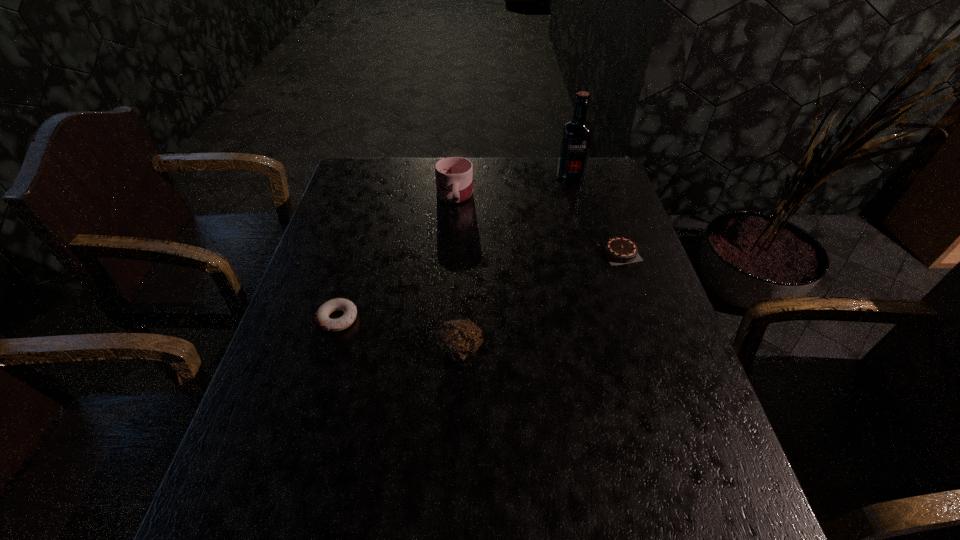
The image size is (960, 540). Identify the location of the tallest object. (576, 137).

The image size is (960, 540). I want to click on the second tallest object, so click(x=454, y=175).

Identify the location of muffin. Image resolution: width=960 pixels, height=540 pixels. (459, 339).

Locate an element on the screen. the third nearest object is located at coordinates (617, 249).

The height and width of the screenshot is (540, 960). In order to click on doughnut in this screenshot , I will do `click(322, 319)`.

I want to click on free space located 0.370m on the front-facing side of the liquor, so click(x=591, y=258).

Where is `vacant region located on the side with the handle of the mug`? vacant region located on the side with the handle of the mug is located at coordinates (452, 227).

Image resolution: width=960 pixels, height=540 pixels. In order to click on vacant area situated on the front of the third shortest object in this screenshot , I will do `click(455, 472)`.

I want to click on vacant space positioned on the back of the chocolate cake, so click(x=592, y=169).

You are a GUI agent. You are given a task and a screenshot of the screen. Output one action in this format:
    pyautogui.click(x=<x>, y=<y>)
    Task: Click on the vacant space situated on the right of the leftmost object
    The width and height of the screenshot is (960, 540).
    Given the screenshot: What is the action you would take?
    pyautogui.click(x=469, y=319)